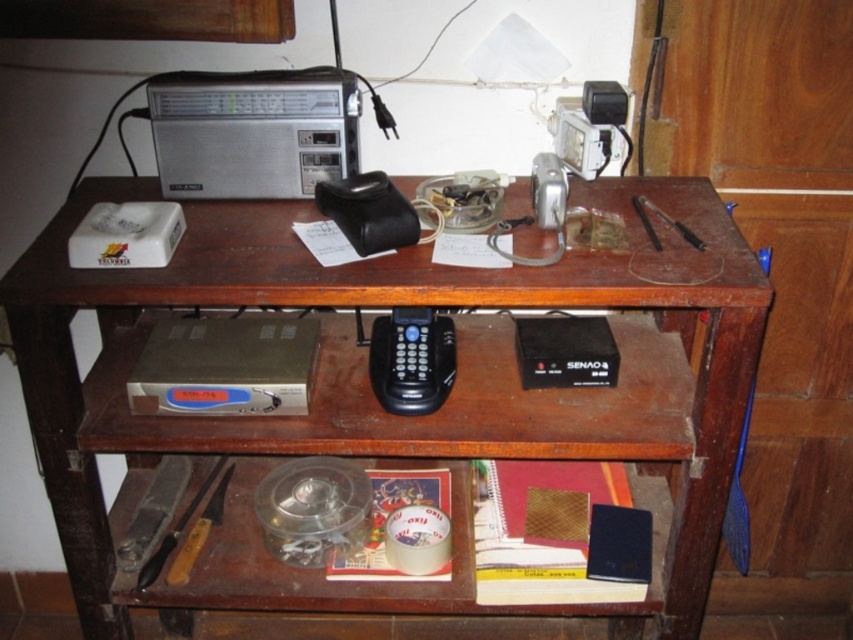
Is metallic gray tool at lower left positioned before wooden-handled knife at lower left?

No, metallic gray tool at lower left is further to the viewer.

Does metallic gray tool at lower left have a greater width compared to wooden-handled knife at lower left?

Yes.

Is point (132, 563) positioned in front of point (184, 579)?

That is False.

At what (x,y) coordinates should I click in order to perform the action: click on metallic gray tool at lower left. Please return your answer as a coordinate pair (x, y). Image resolution: width=853 pixels, height=640 pixels. Looking at the image, I should click on (154, 509).

Is brown wooden table at center further to camera compared to black plastic phone at center?

No, it is in front of black plastic phone at center.

Can you confirm if brown wooden table at center is bigger than black plastic phone at center?

Indeed, brown wooden table at center has a larger size compared to black plastic phone at center.

Identify the location of brown wooden table at center. The height and width of the screenshot is (640, 853). (363, 305).

Is black plastic phone at center to the right of wooden-handled knife at lower left from the viewer's perspective?

Correct, you'll find black plastic phone at center to the right of wooden-handled knife at lower left.

Measure the distance between black plastic phone at center and wooden-handled knife at lower left.

black plastic phone at center and wooden-handled knife at lower left are 16.97 inches apart.

Between point (431, 333) and point (225, 468), which one is positioned behind?

Point (225, 468)

Locate an element on the screen. This screenshot has width=853, height=640. black plastic phone at center is located at coordinates (410, 358).